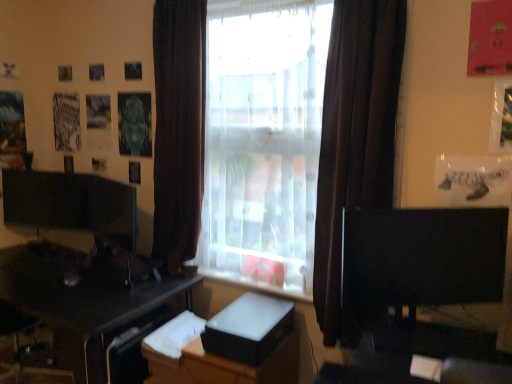
Question: Is brown fabric curtain at center, which appears as the 2th curtain when viewed from the right, looking in the opposite direction of black glossy desk at lower left?

Choices:
 (A) no
 (B) yes

Answer: (A)

Question: From the image's perspective, would you say brown fabric curtain at center, which appears as the 2th curtain when viewed from the right, is shown under black glossy desk at lower left?

Choices:
 (A) yes
 (B) no

Answer: (B)

Question: Does brown fabric curtain at center, which appears as the 2th curtain when viewed from the right, have a larger size compared to black glossy desk at lower left?

Choices:
 (A) no
 (B) yes

Answer: (A)

Question: Does brown fabric curtain at center, which appears as the 2th curtain when viewed from the right, have a lesser height compared to black glossy desk at lower left?

Choices:
 (A) yes
 (B) no

Answer: (B)

Question: Is brown fabric curtain at center, which appears as the 2th curtain when viewed from the right, far from black glossy desk at lower left?

Choices:
 (A) yes
 (B) no

Answer: (B)

Question: Is brown fabric curtain at center, which ranks as the 1th curtain in left-to-right order, further to the viewer compared to black glossy desk at lower left?

Choices:
 (A) no
 (B) yes

Answer: (B)

Question: From a real-world perspective, is translucent fabric window at center below white glossy dresser at center?

Choices:
 (A) no
 (B) yes

Answer: (A)

Question: From the image's perspective, is translucent fabric window at center on top of white glossy dresser at center?

Choices:
 (A) no
 (B) yes

Answer: (B)

Question: Is translucent fabric window at center taller than white glossy dresser at center?

Choices:
 (A) yes
 (B) no

Answer: (A)

Question: From the image's perspective, does translucent fabric window at center appear lower than white glossy dresser at center?

Choices:
 (A) yes
 (B) no

Answer: (B)

Question: Considering the relative sizes of translucent fabric window at center and white glossy dresser at center in the image provided, is translucent fabric window at center smaller than white glossy dresser at center?

Choices:
 (A) no
 (B) yes

Answer: (A)

Question: Is translucent fabric window at center not within white glossy dresser at center?

Choices:
 (A) no
 (B) yes

Answer: (B)

Question: Is white glossy dresser at center further to camera compared to translucent fabric window at center?

Choices:
 (A) yes
 (B) no

Answer: (A)